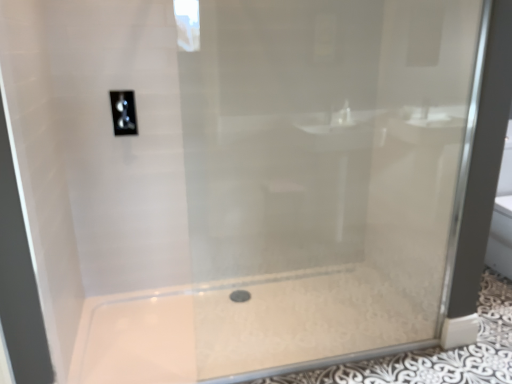
Question: From a real-world perspective, does satin nickel toggle at upper center sit lower than white glossy bath at center?

Choices:
 (A) no
 (B) yes

Answer: (A)

Question: Could white glossy bath at center be considered to be inside satin nickel toggle at upper center?

Choices:
 (A) yes
 (B) no

Answer: (B)

Question: Is satin nickel toggle at upper center oriented away from white glossy bath at center?

Choices:
 (A) no
 (B) yes

Answer: (A)

Question: Is satin nickel toggle at upper center not inside white glossy bath at center?

Choices:
 (A) yes
 (B) no

Answer: (A)

Question: Can you confirm if satin nickel toggle at upper center is positioned to the right of white glossy bath at center?

Choices:
 (A) no
 (B) yes

Answer: (A)

Question: Does satin nickel toggle at upper center appear on the left side of white glossy bath at center?

Choices:
 (A) yes
 (B) no

Answer: (A)

Question: Does white glossy bath at center have a lesser width compared to satin nickel toggle at upper center?

Choices:
 (A) yes
 (B) no

Answer: (B)

Question: Can you confirm if white glossy bath at center is smaller than satin nickel toggle at upper center?

Choices:
 (A) yes
 (B) no

Answer: (B)

Question: From the image's perspective, is white glossy bath at center located above satin nickel toggle at upper center?

Choices:
 (A) no
 (B) yes

Answer: (A)

Question: Can you confirm if white glossy bath at center is bigger than satin nickel toggle at upper center?

Choices:
 (A) no
 (B) yes

Answer: (B)

Question: From a real-world perspective, is white glossy bath at center under satin nickel toggle at upper center?

Choices:
 (A) yes
 (B) no

Answer: (A)

Question: Is the position of white glossy bath at center less distant than that of satin nickel toggle at upper center?

Choices:
 (A) yes
 (B) no

Answer: (A)

Question: In terms of width, does satin nickel toggle at upper center look wider or thinner when compared to white glossy bath at center?

Choices:
 (A) thin
 (B) wide

Answer: (A)